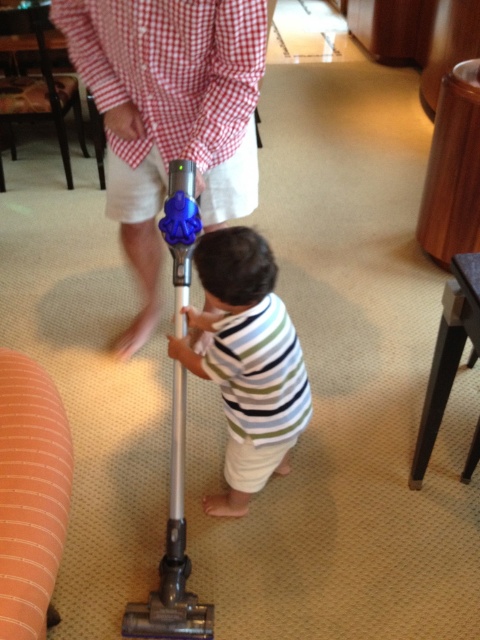
You are organizing a laundry day and need to fold the checkered fabric shirt at upper center and the striped cotton shirt at center. Which shirt should you place on the left side of the shelf to match their positions in the image?

The checkered fabric shirt at upper center should be placed on the left side of the shelf since it was originally positioned to the left of the striped cotton shirt at center in the image.

You are a robot trying to determine which point is closer to you in the image. You see two points labeled as point (152, 29) and point (269, 291). Which point is closer to you?

Point (152, 29) is closer to the viewer than point (269, 291).